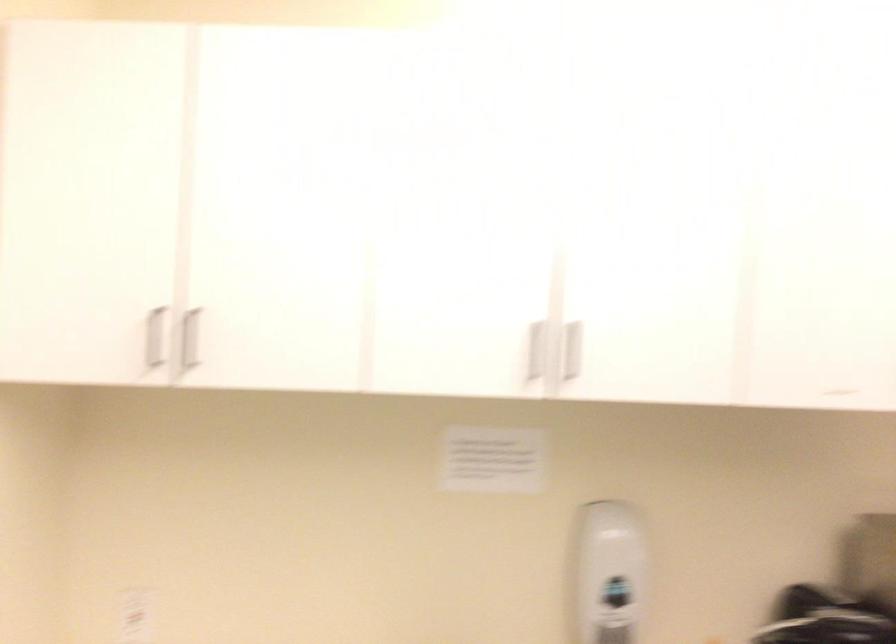
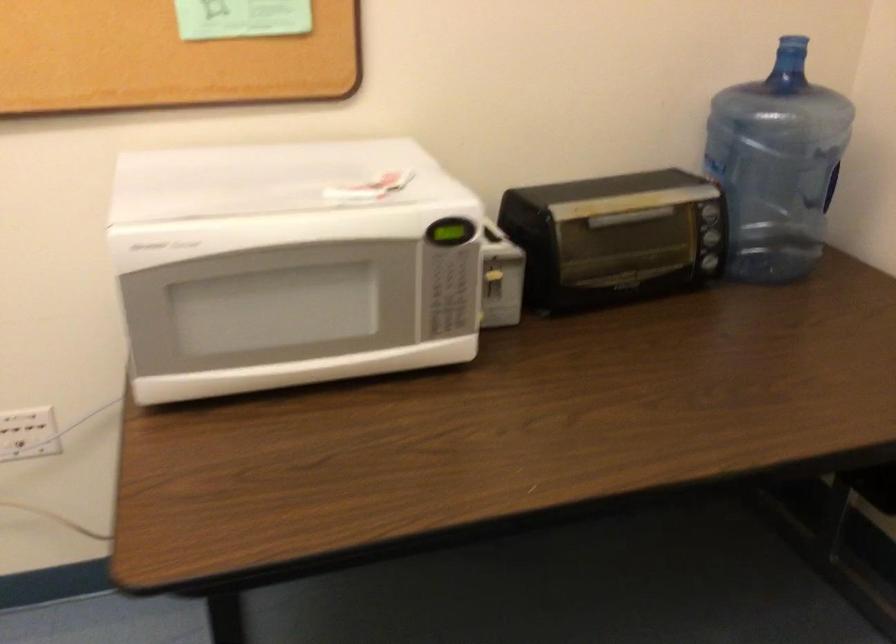
Based on the continuous images, in which direction is the camera rotating?

The camera rotated toward right-down.